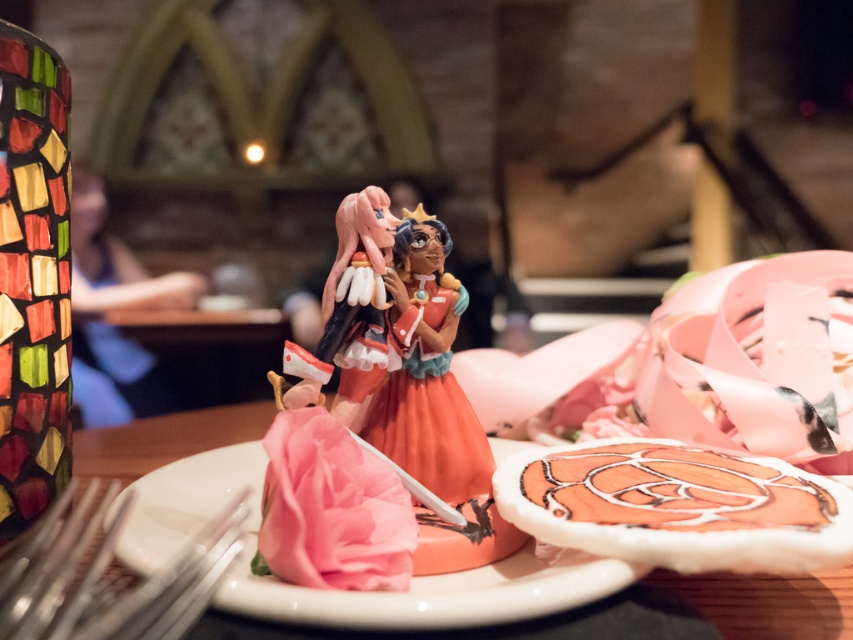
You are standing in front of a table with a porcelain figurine at center. If your eyes are at a height of 5 feet, will the figurine be visible above the table edge?

The porcelain figurine at center is 23.21 inches away from the viewer. Since 23.21 inches is less than 5 feet, the figurine will be visible above the table edge.

You are a chef holding a 10 inch long knife. You need to place the knife between the metallic silver fork at lower left and the camera. Is there enough space?

The metallic silver fork at lower left and the camera are 10.57 inches apart. Since the knife is 10 inches long, there is enough space to place it between them.

You are arranging a dinner setting and need to place the metallic silver fork at lower left and the smooth blue shirt at center. According to the image, which object is closer to you?

The metallic silver fork at lower left is closer to you because it is in front of the smooth blue shirt at center.